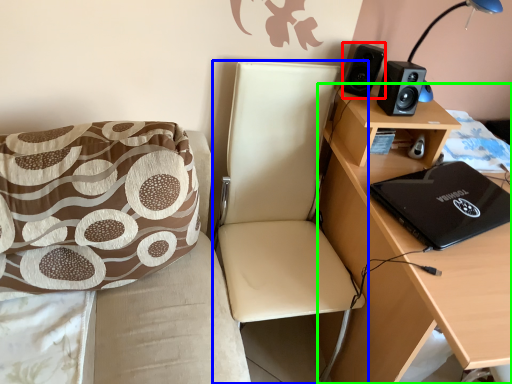
Question: Which object is the closest to the speaker (highlighted by a red box)? Choose among these: chair (highlighted by a blue box) or desk (highlighted by a green box).

Choices:
 (A) chair
 (B) desk

Answer: (A)